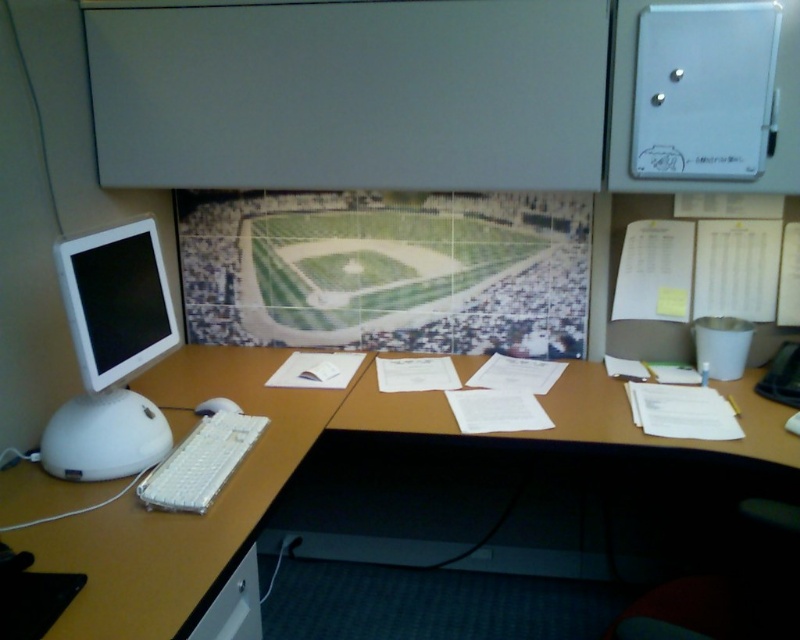
Which of these two, white plastic keyboard at lower left or white plastic mouse at lower left, stands taller?

With more height is white plastic keyboard at lower left.

The height and width of the screenshot is (640, 800). Identify the location of white plastic keyboard at lower left. (200, 464).

Is point (158, 262) farther from camera compared to point (158, 474)?

Yes, point (158, 262) is farther from viewer.

Who is taller, white glossy monitor at left or white plastic keyboard at lower left?

white glossy monitor at left is taller.

Consider the image. Measure the distance between point (97, 268) and camera.

1.45 meters

At what (x,y) coordinates should I click in order to perform the action: click on white glossy monitor at left. Please return your answer as a coordinate pair (x, y). The image size is (800, 640). Looking at the image, I should click on (112, 353).

This screenshot has width=800, height=640. I want to click on white plastic computer desk at center, so tap(218, 496).

You are a GUI agent. You are given a task and a screenshot of the screen. Output one action in this format:
    pyautogui.click(x=<x>, y=<y>)
    Task: Click on the white plastic computer desk at center
    This screenshot has height=640, width=800.
    Given the screenshot: What is the action you would take?
    pyautogui.click(x=218, y=496)

Find the location of a particular element. The image size is (800, 640). white plastic computer desk at center is located at coordinates (218, 496).